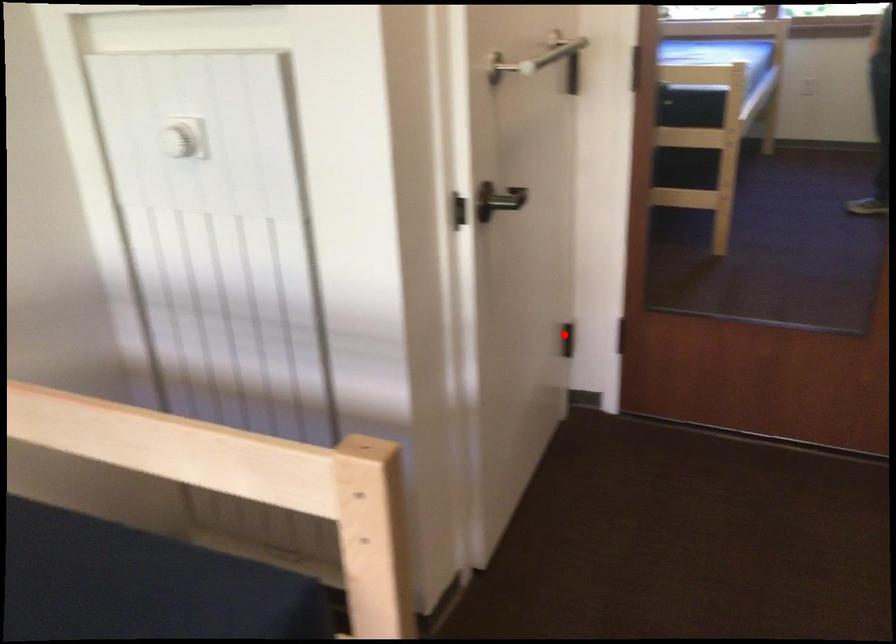
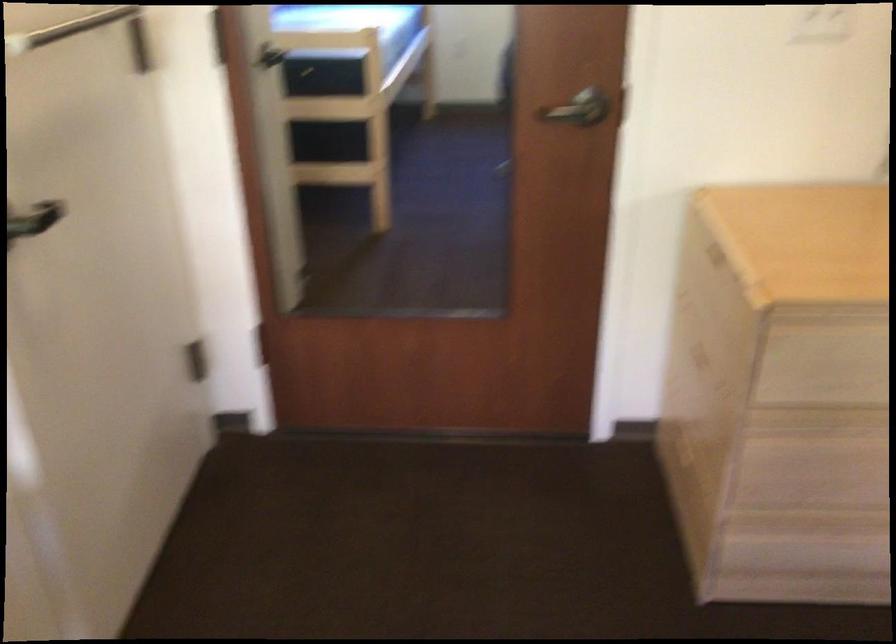
The point at the highlighted location is marked in the first image. Where is the corresponding point in the second image?

(195, 357)